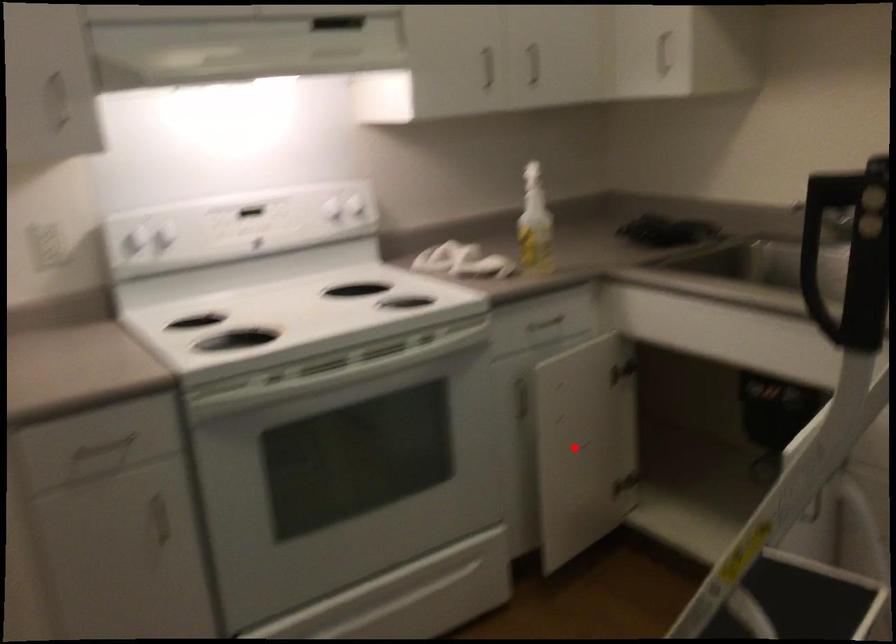
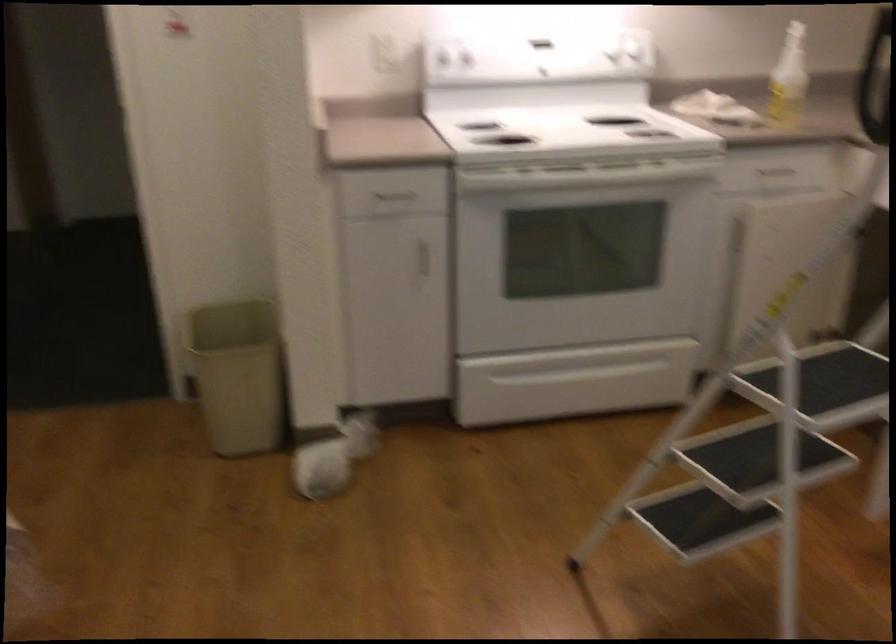
Question: I am providing you with two images of the same scene from different viewpoints. A red point is marked on the first image. Is the red point's position out of view in image 2?

Choices:
 (A) Yes
 (B) No

Answer: (A)